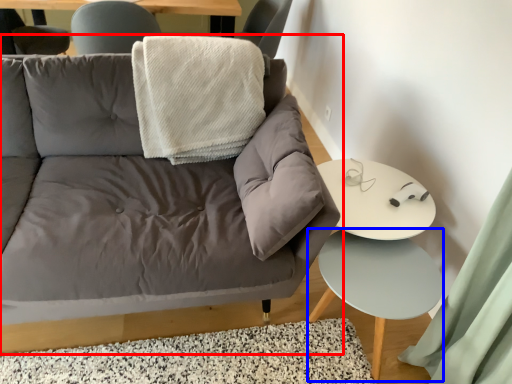
Question: Which object appears farthest to the camera in this image, studio couch (highlighted by a red box) or side table (highlighted by a blue box)?

Choices:
 (A) studio couch
 (B) side table

Answer: (B)